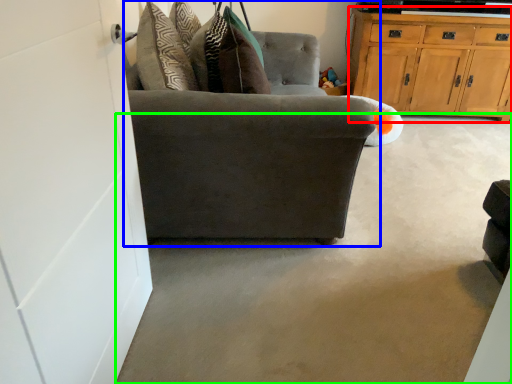
Question: Which is farther away from cabinetry (highlighted by a red box)? chair (highlighted by a blue box) or concrete (highlighted by a green box)?

Choices:
 (A) chair
 (B) concrete

Answer: (A)